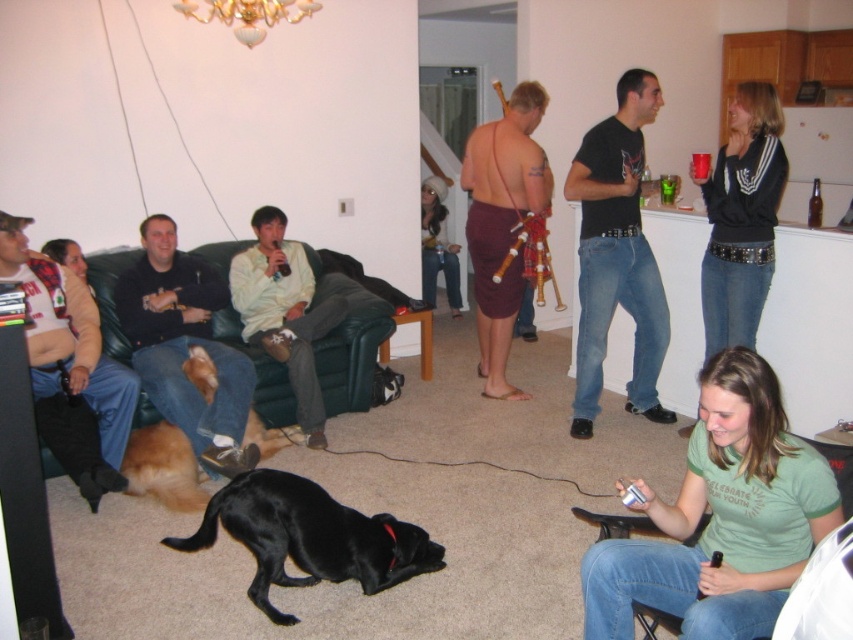
Question: Does satin black jacket at upper right appear under brown fur dog at lower left?

Choices:
 (A) no
 (B) yes

Answer: (A)

Question: Does black leather jacket at left lie in front of brown fur dog at lower left?

Choices:
 (A) no
 (B) yes

Answer: (B)

Question: Among these points, which one is nearest to the camera?

Choices:
 (A) (198, 372)
 (B) (543, 193)

Answer: (A)

Question: Which point is closer to the camera?

Choices:
 (A) (425, 275)
 (B) (173, 474)
 (C) (175, 316)
 (D) (735, 148)

Answer: (B)

Question: Which of the following is the farthest from the observer?

Choices:
 (A) brown woven cloth at center
 (B) green cotton shirt at lower right
 (C) flannel shirt at left

Answer: (A)

Question: Can you confirm if green cotton shirt at lower right is positioned to the right of brown woven cloth at center?

Choices:
 (A) yes
 (B) no

Answer: (A)